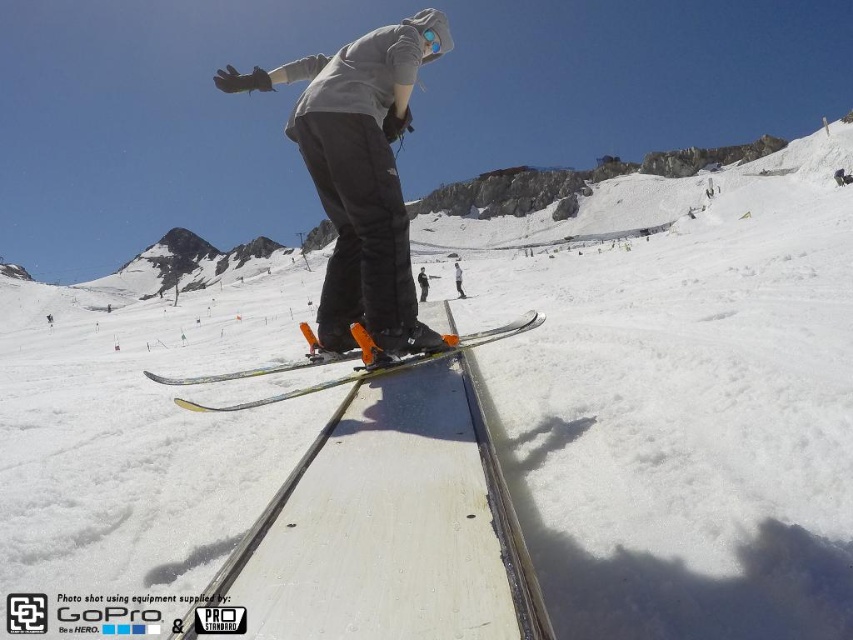
You are a photographer standing at the bottom of the slope and want to capture both the matte gray hoodie at center and the white matte snowboarder at center in your photo. Which one will appear larger in the photo?

The matte gray hoodie at center will appear larger in the photo because it is closer to the viewer than the white matte snowboarder at center.

You are a drone operator trying to capture the perfect shot of the matte gray hoodie at center from above. The resort requires all drone shots to be within a 100m radius of the center point. Given that the resort map uses coordinates where each unit corresponds to 10 meters, is your drone within the allowed area?

The matte gray hoodie at center is located at coordinates [360,173]. Each unit equals 10 meters, so the distance from the center is sqrt. Since the resort allows up to 100m radius, the drone is within the allowed area.